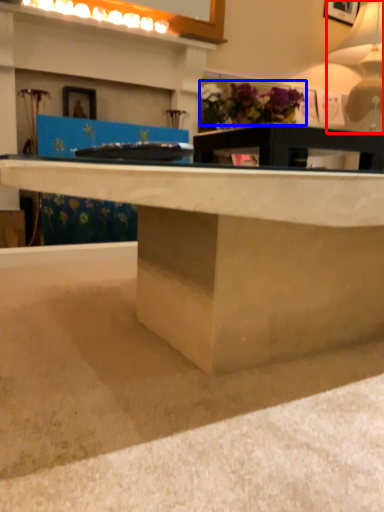
Question: Among these objects, which one is farthest to the camera, table lamp (highlighted by a red box) or flower (highlighted by a blue box)?

Choices:
 (A) table lamp
 (B) flower

Answer: (B)